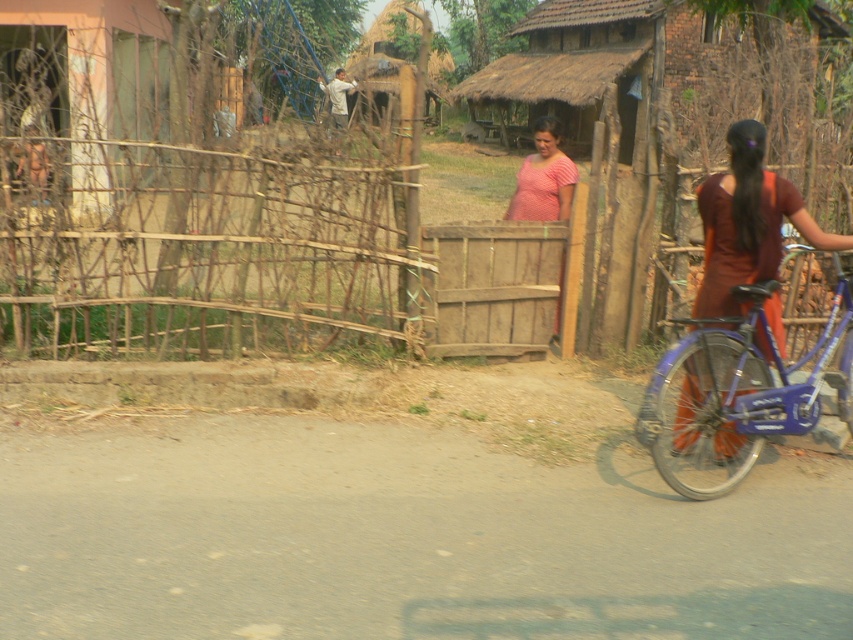
Is point (200, 312) in front of point (515, 212)?

Yes, point (200, 312) is in front of point (515, 212).

Who is more forward, (381, 305) or (521, 168)?

A: Point (381, 305) is in front.

Is point (158, 316) less distant than point (535, 131)?

That is True.

Find the location of a particular element. Image resolution: width=853 pixels, height=640 pixels. bare wood fence at left is located at coordinates (198, 248).

Which is behind, point (193, 170) or point (761, 212)?

The point (193, 170) is behind.

Measure the distance between bare wood fence at left and camera.

Result: bare wood fence at left and camera are 6.77 meters apart.

Where is `bare wood fence at left`? The width and height of the screenshot is (853, 640). bare wood fence at left is located at coordinates (198, 248).

Can you confirm if maroon fabric dress at right is positioned to the left of pink striped shirt at center?

Incorrect, maroon fabric dress at right is not on the left side of pink striped shirt at center.

Which is in front, point (679, 449) or point (541, 122)?

Point (679, 449) is more forward.

You are a GUI agent. You are given a task and a screenshot of the screen. Output one action in this format:
    pyautogui.click(x=<x>, y=<y>)
    Task: Click on the maroon fabric dress at right
    The image size is (853, 640).
    Given the screenshot: What is the action you would take?
    pyautogui.click(x=747, y=221)

Where is `maroon fabric dress at right`? Image resolution: width=853 pixels, height=640 pixels. maroon fabric dress at right is located at coordinates (747, 221).